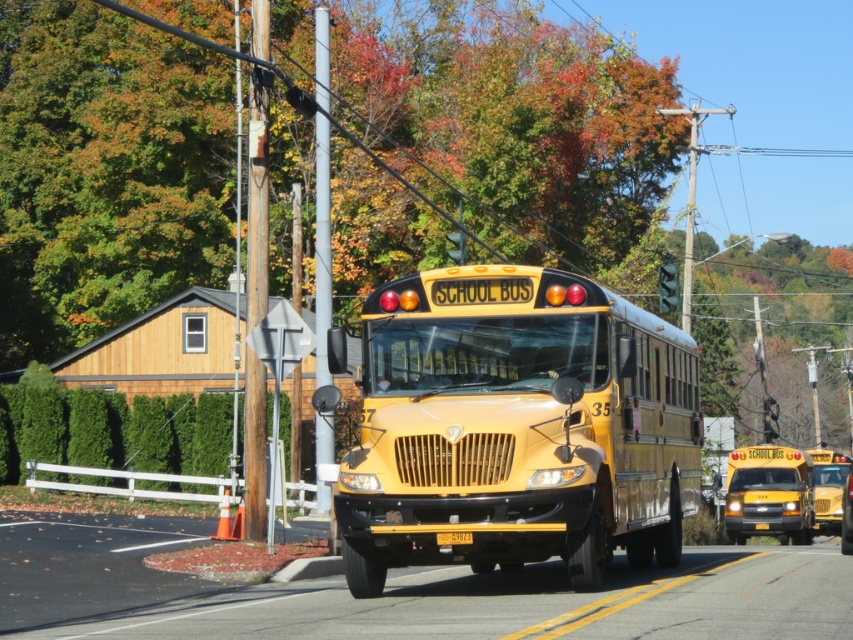
You are standing at the point labeled as point [515,428] in the image. Looking around, you see the yellow matte solid school bus at center. What object are you directly facing?

The point [515,428] corresponds to the yellow matte solid school bus at center, so you are directly facing the yellow matte solid school bus at center.

You are standing at the point with coordinates [515,428] in the image. What object is exactly at your current position?

The yellow matte solid school bus at center is exactly at the point [515,428].